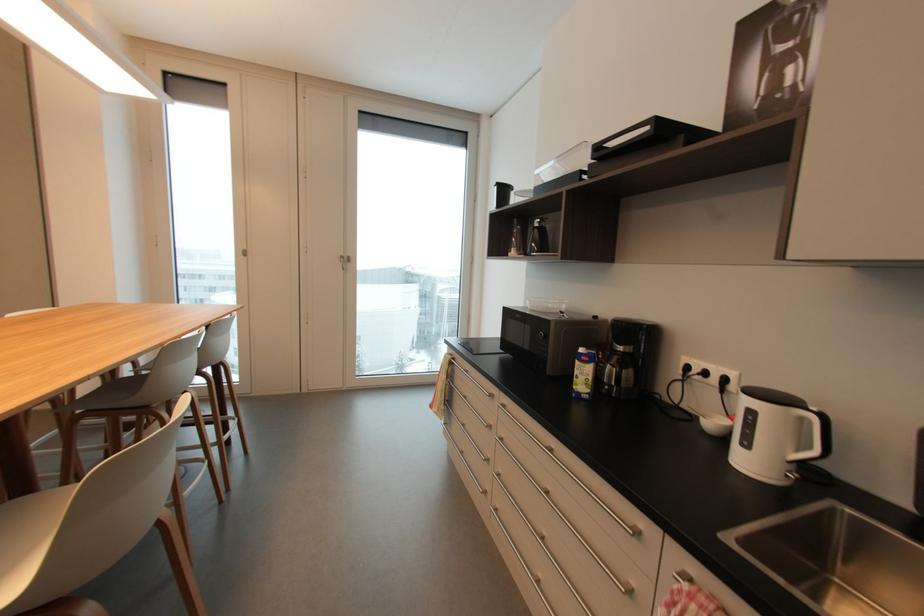
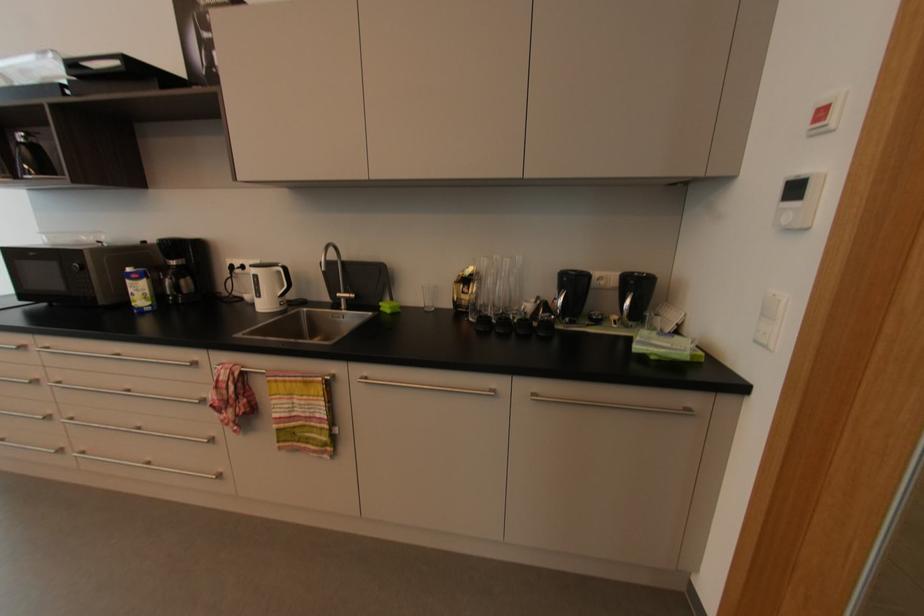
Find the pixel in the second image that matches (585,351) in the first image.

(131, 270)